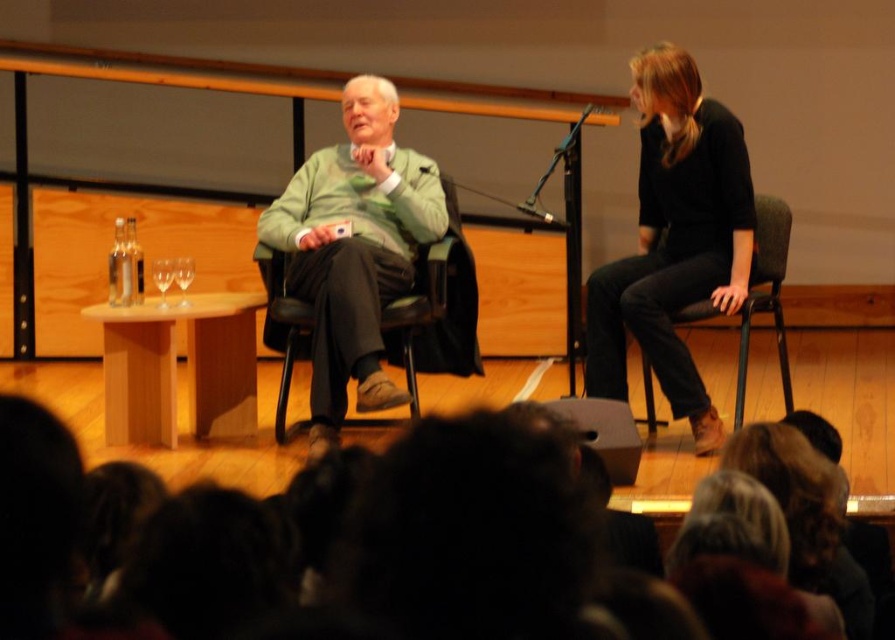
Question: Which of the following is the farthest from the observer?

Choices:
 (A) (782, 348)
 (B) (193, 268)
 (C) (386, 224)

Answer: (C)

Question: Which object is the closest to the black matte dress at right?

Choices:
 (A) leather-like black chair at right
 (B) clear glass wine glass at center
 (C) clear glass wine glass at left
 (D) black matte microphone at upper center

Answer: (A)

Question: Is leather-like black chair at right below black matte microphone at upper center?

Choices:
 (A) yes
 (B) no

Answer: (A)

Question: Is leather-like black chair at right to the left of clear glass wine glass at center from the viewer's perspective?

Choices:
 (A) yes
 (B) no

Answer: (B)

Question: Which point is farther to the camera?

Choices:
 (A) (648, 403)
 (B) (702, 442)
 (C) (155, 278)
 (D) (429, 173)

Answer: (D)

Question: Can you confirm if black matte dress at right is smaller than leather-like black chair at right?

Choices:
 (A) no
 (B) yes

Answer: (B)